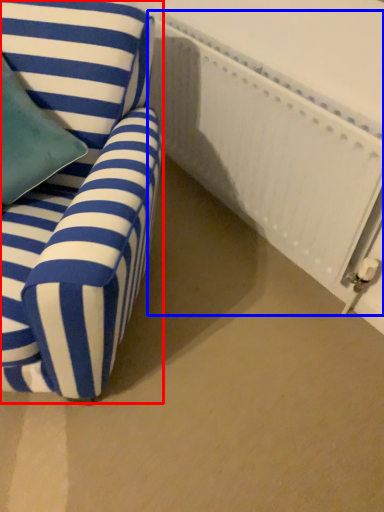
Question: Which object appears farthest to the camera in this image, chair (highlighted by a red box) or radiator (highlighted by a blue box)?

Choices:
 (A) chair
 (B) radiator

Answer: (B)